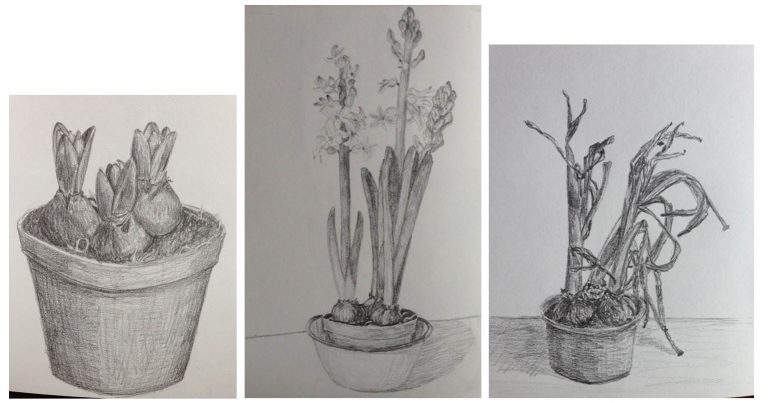
The height and width of the screenshot is (403, 768). What are the coordinates of `large box` in the screenshot? It's located at 263,45.